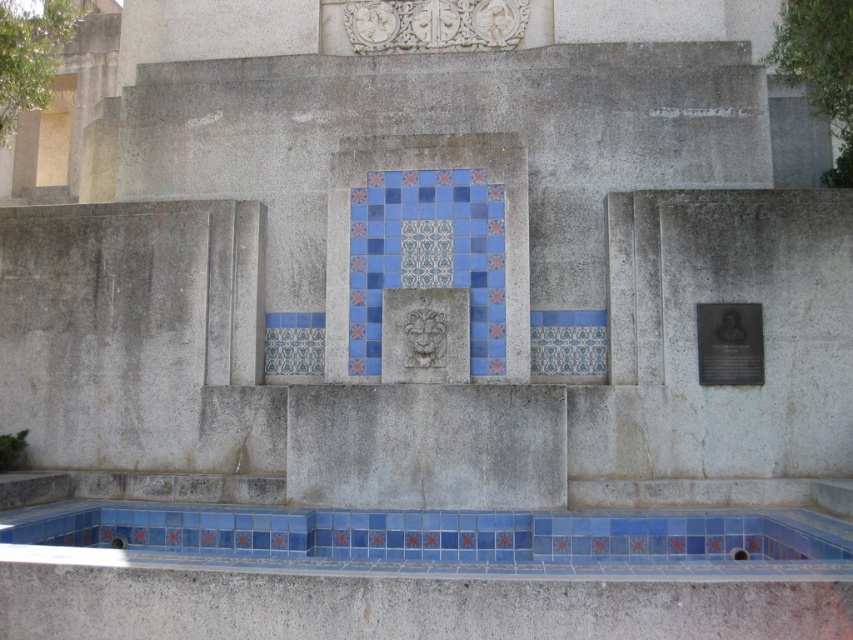
Question: Is blue tile pool at lower center smaller than black polished metal plaque at right?

Choices:
 (A) yes
 (B) no

Answer: (B)

Question: Among these points, which one is farthest from the camera?

Choices:
 (A) (711, 531)
 (B) (724, 344)

Answer: (B)

Question: Can you confirm if blue tile pool at lower center is bigger than black polished metal plaque at right?

Choices:
 (A) yes
 (B) no

Answer: (A)

Question: Among these points, which one is nearest to the camera?

Choices:
 (A) (61, 525)
 (B) (728, 371)

Answer: (A)

Question: Is blue tile pool at lower center to the right of black polished metal plaque at right from the viewer's perspective?

Choices:
 (A) no
 (B) yes

Answer: (A)